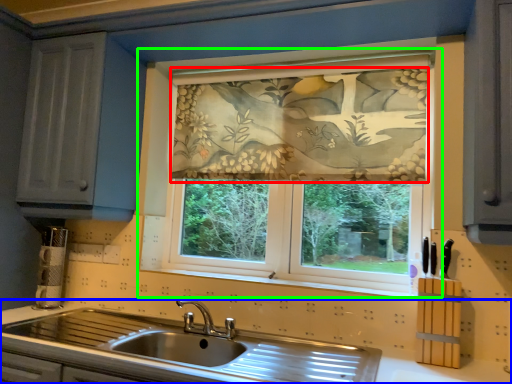
Question: Considering the real-world distances, which object is closest to curtain (highlighted by a red box)? countertop (highlighted by a blue box) or window (highlighted by a green box).

Choices:
 (A) countertop
 (B) window

Answer: (B)